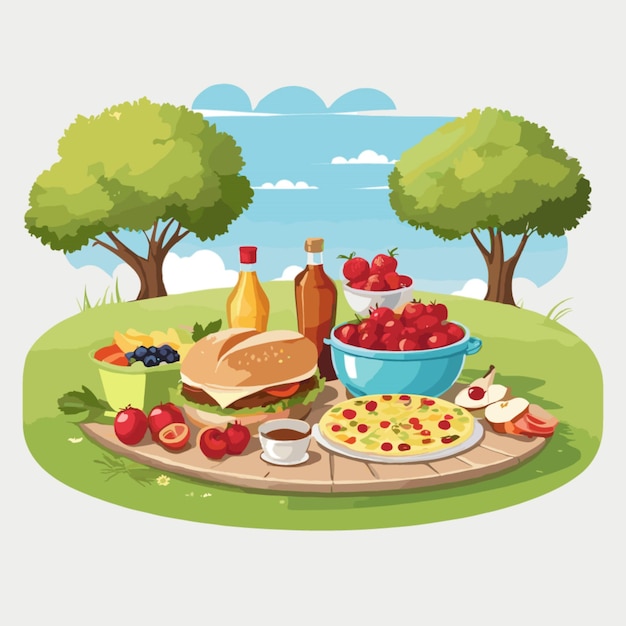
Image resolution: width=626 pixels, height=626 pixels. Find the location of `bowls`. bowls is located at coordinates (404, 370), (355, 295), (141, 384).